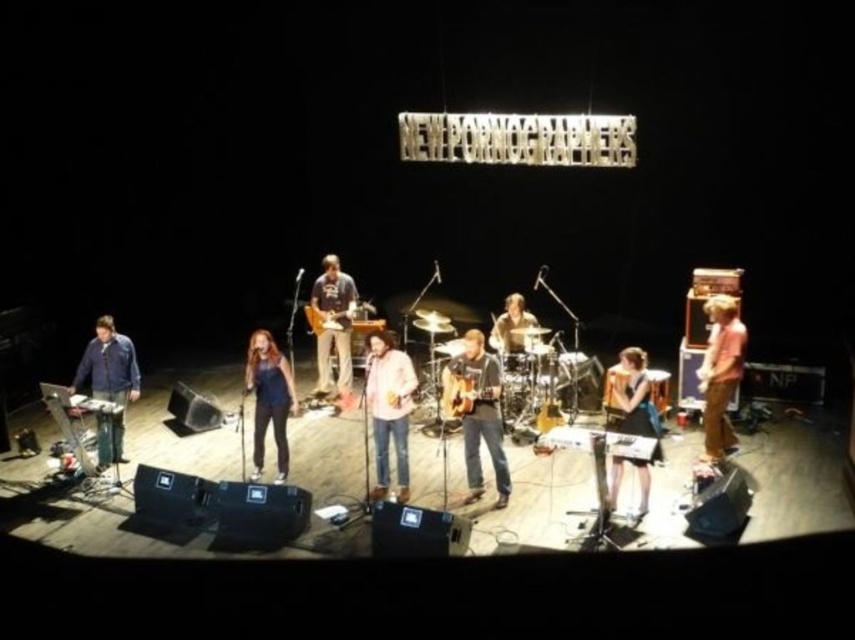
Measure the distance between matte blue shirt at left and camera.

The distance of matte blue shirt at left from camera is 7.41 meters.

Is matte blue shirt at left above blue denim jeans at center?

Incorrect, matte blue shirt at left is not positioned above blue denim jeans at center.

Where is `matte blue shirt at left`? The image size is (855, 640). matte blue shirt at left is located at coordinates (109, 385).

From the picture: Is white cotton shirt at center to the left of smooth brown guitar at center from the viewer's perspective?

Yes, white cotton shirt at center is to the left of smooth brown guitar at center.

The width and height of the screenshot is (855, 640). I want to click on white cotton shirt at center, so click(x=388, y=412).

Who is shorter, matte blue shirt at left or matte black dress at lower right?

matte black dress at lower right

Identify the location of matte blue shirt at left. This screenshot has height=640, width=855. (109, 385).